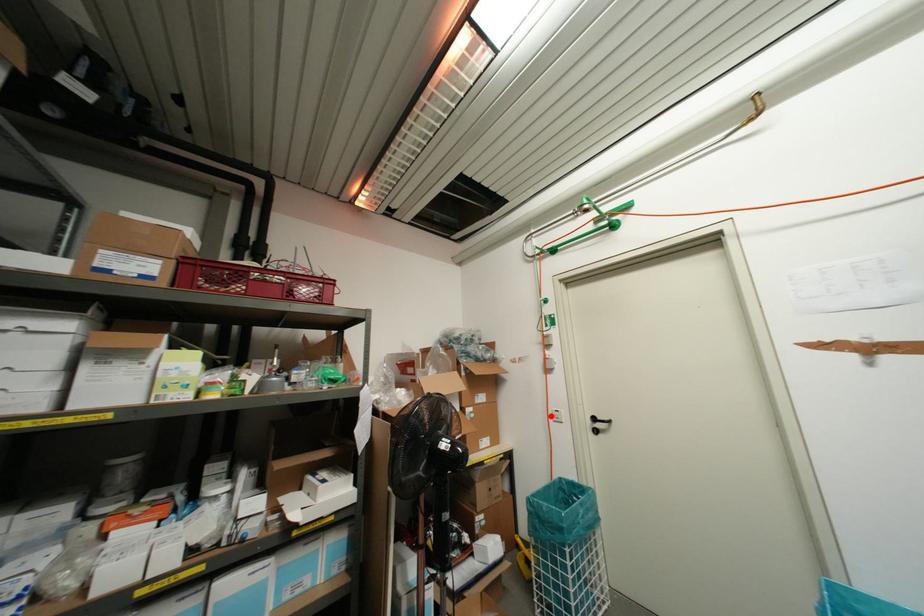
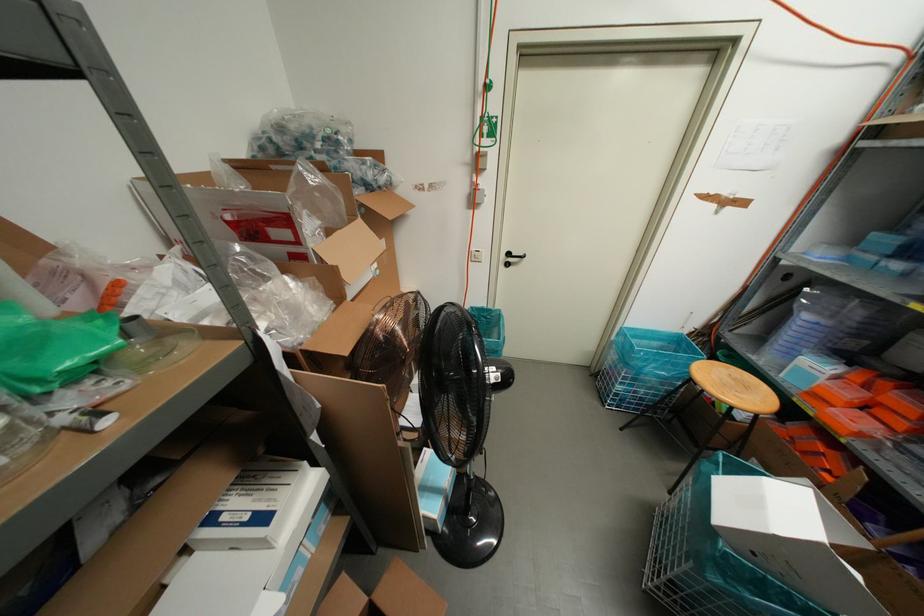
Question: I am providing you with two images of the same scene from different viewpoints. Image1 has a red point marked. In image2, the corresponding 3D location appears at what relative position? Reply with the corresponding letter.

Choices:
 (A) Closer
 (B) Farther

Answer: (A)